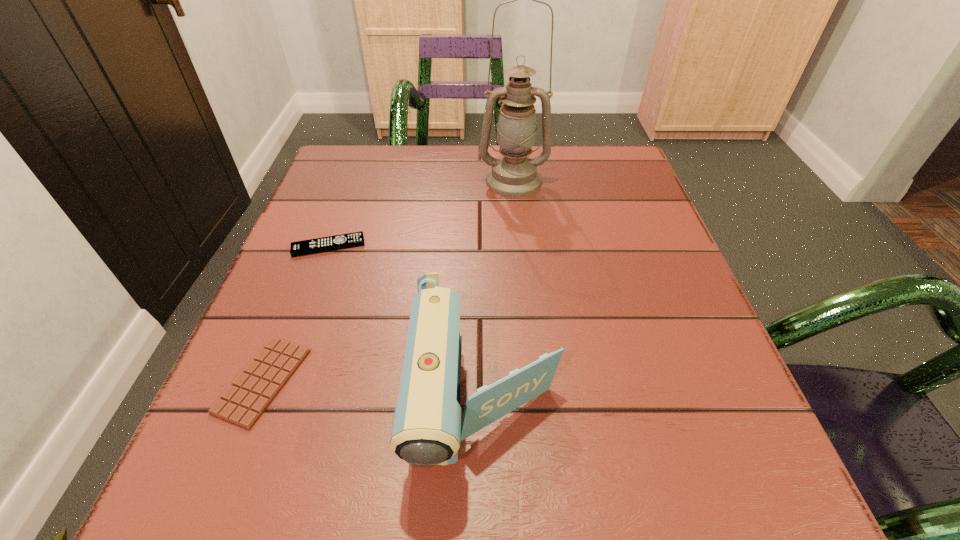
I want to click on object that is at the near edge, so [x=427, y=429].

Image resolution: width=960 pixels, height=540 pixels. What are the coordinates of `remote control that is at the left edge` in the screenshot? It's located at (331, 243).

Identify the location of candy bar at the left edge. (243, 403).

Where is `free space at the far edge of the desktop`? This screenshot has width=960, height=540. free space at the far edge of the desktop is located at coordinates (396, 183).

In the image, there is a desktop. At what (x,y) coordinates should I click in order to perform the action: click on vacant area at the left edge. Please return your answer as a coordinate pair (x, y). The image size is (960, 540). Looking at the image, I should click on (291, 406).

This screenshot has width=960, height=540. Identify the location of blank area at the right edge. (681, 415).

In the image, there is a desktop. Identify the location of blank space at the far left corner. This screenshot has height=540, width=960. (321, 182).

You are a GUI agent. You are given a task and a screenshot of the screen. Output one action in this format:
    pyautogui.click(x=<x>, y=<y>)
    Task: Click on the vacant space at the far right corner
    This screenshot has width=960, height=540.
    Given the screenshot: What is the action you would take?
    pyautogui.click(x=621, y=169)

Where is `vacant region at the near right corner of the desktop`? Image resolution: width=960 pixels, height=540 pixels. vacant region at the near right corner of the desktop is located at coordinates (742, 498).

The height and width of the screenshot is (540, 960). Identify the location of free point between the camcorder and the third nearest object. (407, 325).